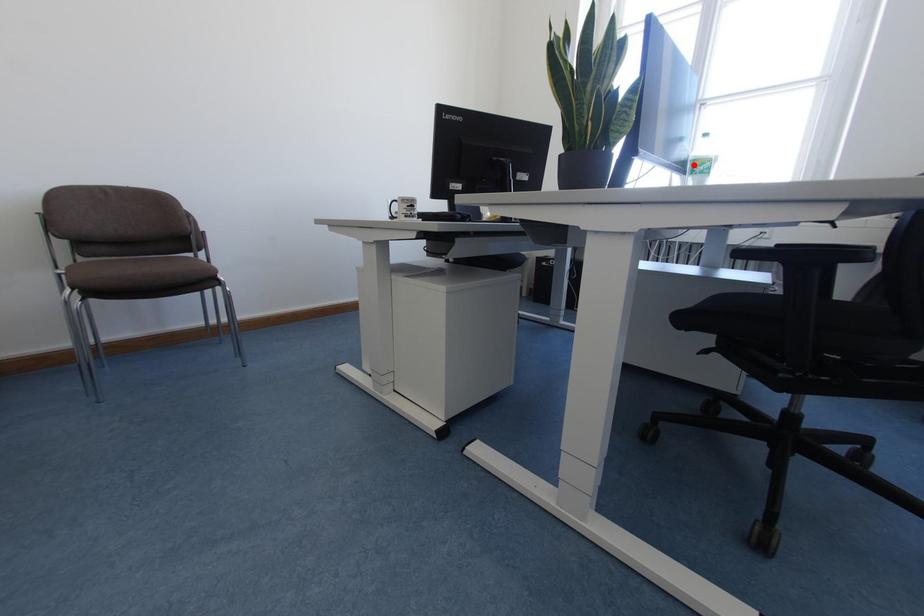
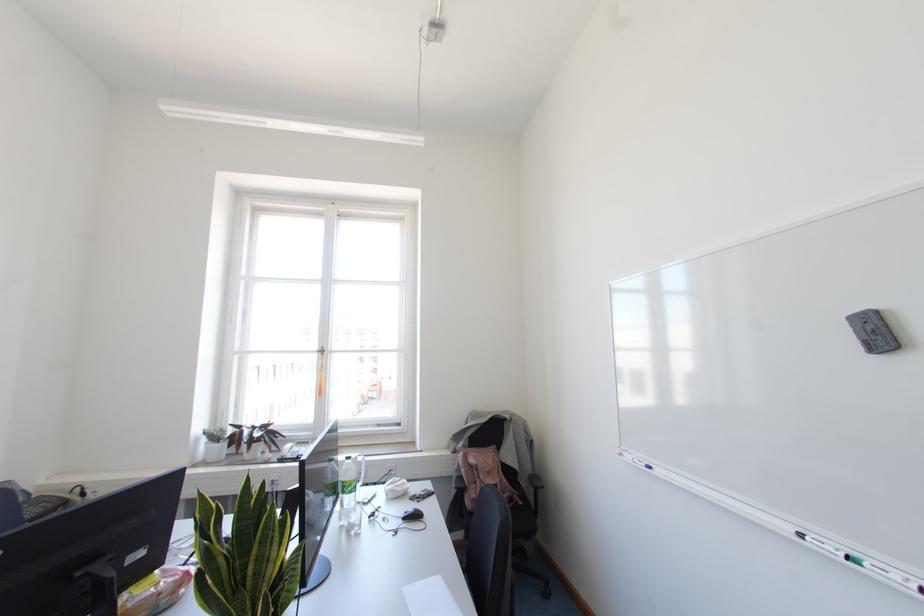
Where in the second image is the point corresponding to the highlighted location from the first image?

(343, 485)